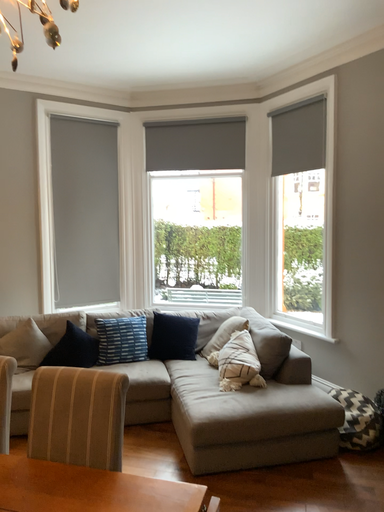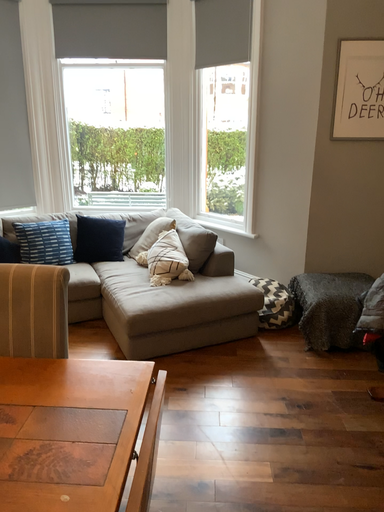
Question: Which way did the camera rotate in the video?

Choices:
 (A) rotated upward
 (B) rotated downward

Answer: (B)